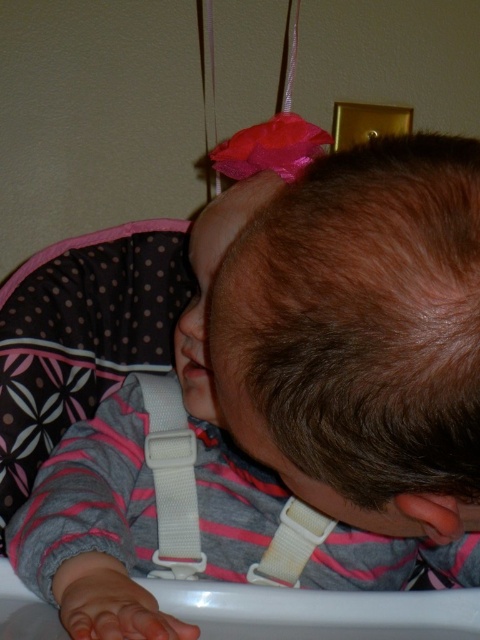
You are a photographer taking a portrait of the child in the high chair. The camera is focused on the brown matte hair at center. Where is the camera positioned relative to the child?

The camera is positioned directly in front of the child because the brown matte hair at center is centered at point coordinates indicating it is facing the camera.

You are a photographer taking a picture of the child in the high chair. The brown matte hair at center and the white fabric strap at center are both in the frame. Which object is closer to the camera?

The brown matte hair at center is closer to the camera because it is in front of the white fabric strap at center.

You are a photographer positioned in front of the child in the high chair. You want to take a clear photo of the child but notice their brown matte hair at center is partially covering their face. Based on the distance between you and the hair, can you adjust your position to capture the child without the hair obscuring their face?

The distance between the brown matte hair at center and the viewer is 10.14 inches. By moving slightly to the side or angling the camera, you can avoid the hair obscuring the child, as there is enough space to reposition without getting too close.